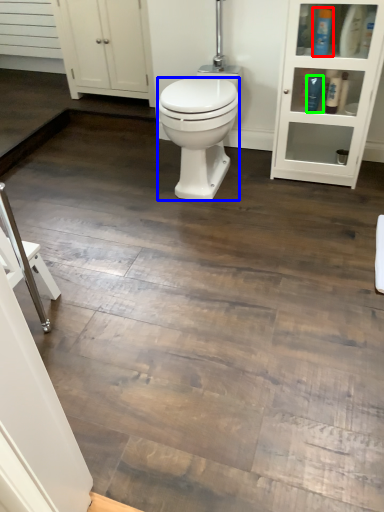
Question: Estimate the real-world distances between objects in this image. Which object is farther from toiletry (highlighted by a red box), bidet (highlighted by a blue box) or toiletry (highlighted by a green box)?

Choices:
 (A) bidet
 (B) toiletry

Answer: (A)